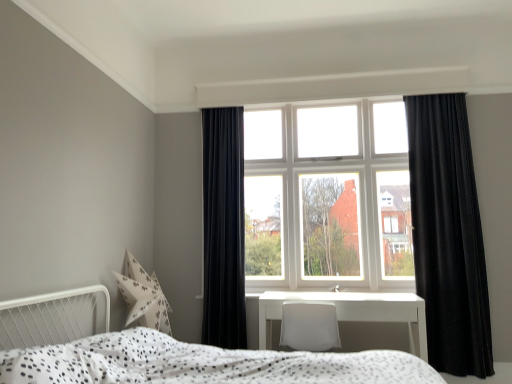
Locate an element on the screen. free space above velvet black curtain at left, the second curtain in the right-to-left sequence (from a real-world perspective) is located at coordinates (223, 95).